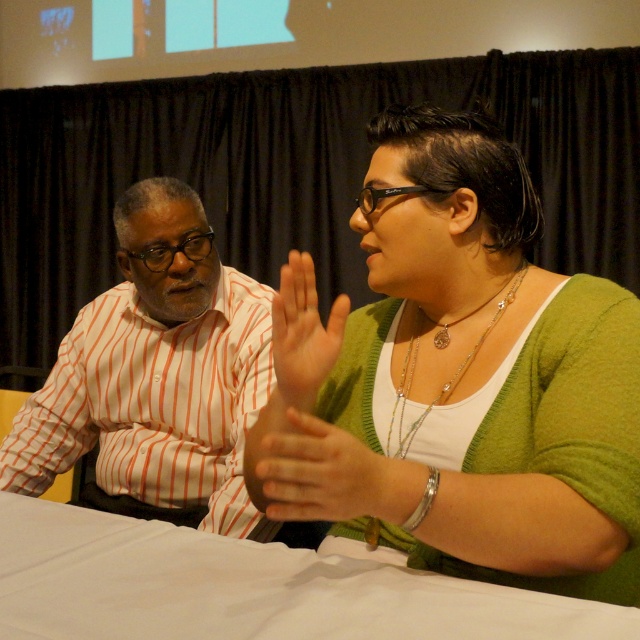
Question: Which point is closer to the camera?

Choices:
 (A) (369, 458)
 (B) (509, 632)
 (C) (307, 298)

Answer: (B)

Question: Which point appears farthest from the camera in this image?

Choices:
 (A) (444, 396)
 (B) (209, 445)
 (C) (140, 531)

Answer: (B)

Question: Is striped cotton shirt at left below matte skin palm at center?

Choices:
 (A) no
 (B) yes

Answer: (B)

Question: Which of the following is the farthest from the observer?

Choices:
 (A) striped cotton shirt at left
 (B) silver/glassy layered necklace at upper center

Answer: (A)

Question: In this image, where is white cloth at lower center located relative to smooth skin hand at center?

Choices:
 (A) below
 (B) above

Answer: (A)

Question: Does green matte sweater at upper right appear over silver/glassy layered necklace at upper center?

Choices:
 (A) yes
 (B) no

Answer: (B)